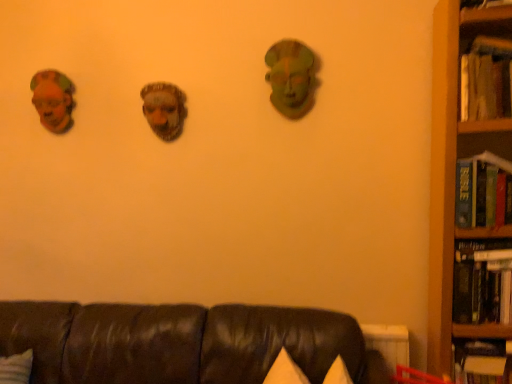
Question: Is wooden bookcase at right looking in the opposite direction of matte brown mask at left?

Choices:
 (A) yes
 (B) no

Answer: (B)

Question: Is wooden bookcase at right touching matte brown mask at left?

Choices:
 (A) yes
 (B) no

Answer: (B)

Question: Considering the relative sizes of wooden bookcase at right and matte brown mask at left in the image provided, is wooden bookcase at right wider than matte brown mask at left?

Choices:
 (A) yes
 (B) no

Answer: (A)

Question: Is matte brown mask at left surrounded by wooden bookcase at right?

Choices:
 (A) no
 (B) yes

Answer: (A)

Question: Considering the relative sizes of wooden bookcase at right and matte brown mask at left in the image provided, is wooden bookcase at right taller than matte brown mask at left?

Choices:
 (A) yes
 (B) no

Answer: (A)

Question: Does point (509, 173) appear closer or farther from the camera than point (104, 326)?

Choices:
 (A) closer
 (B) farther

Answer: (A)

Question: Is hardcover book at right, placed as the 2th book when sorted from top to bottom, bigger or smaller than leather couch at lower center?

Choices:
 (A) small
 (B) big

Answer: (A)

Question: Considering the relative positions of hardcover book at right, the third book when ordered from bottom to top, and leather couch at lower center in the image provided, is hardcover book at right, the third book when ordered from bottom to top, to the left or to the right of leather couch at lower center?

Choices:
 (A) left
 (B) right

Answer: (B)

Question: Choose the correct answer: Is hardcover book at right, placed as the 2th book when sorted from top to bottom, inside leather couch at lower center or outside it?

Choices:
 (A) inside
 (B) outside

Answer: (B)

Question: In terms of width, does leather couch at lower center look wider or thinner when compared to hardcover book at right, which is the fourth book from bottom to top?

Choices:
 (A) wide
 (B) thin

Answer: (A)

Question: Is leather couch at lower center bigger or smaller than hardcover book at right, which is the fourth book from bottom to top?

Choices:
 (A) small
 (B) big

Answer: (B)

Question: Is leather couch at lower center inside the boundaries of hardcover book at right, arranged as the 1th book when viewed from the top, or outside?

Choices:
 (A) inside
 (B) outside

Answer: (B)

Question: Is point (157, 382) closer or farther from the camera than point (502, 67)?

Choices:
 (A) closer
 (B) farther

Answer: (B)

Question: Is leather couch at lower center wider or thinner than hardcover book at right, which is the first book in bottom-to-top order?

Choices:
 (A) wide
 (B) thin

Answer: (A)

Question: From a real-world perspective, is leather couch at lower center above or below hardcover book at right, acting as the 4th book starting from the top?

Choices:
 (A) above
 (B) below

Answer: (A)